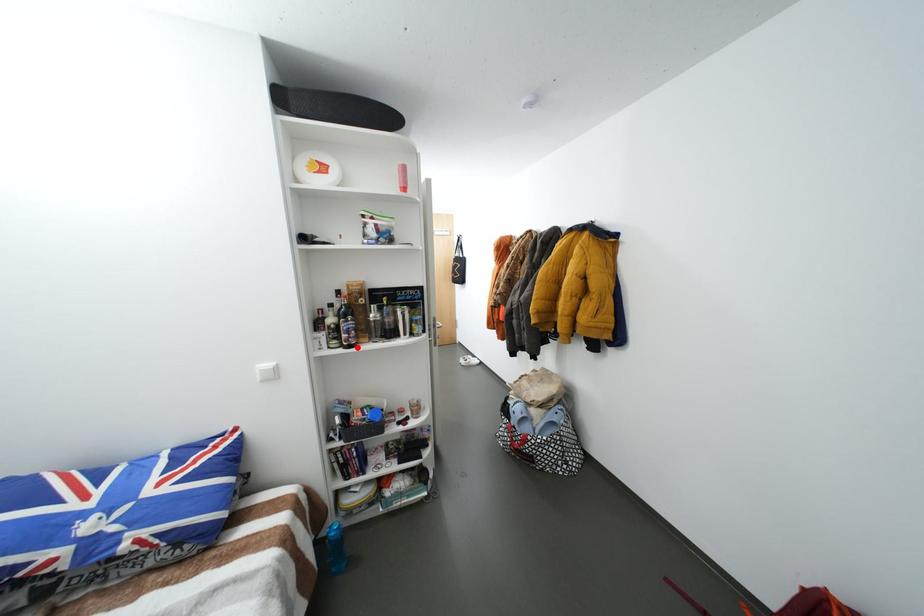
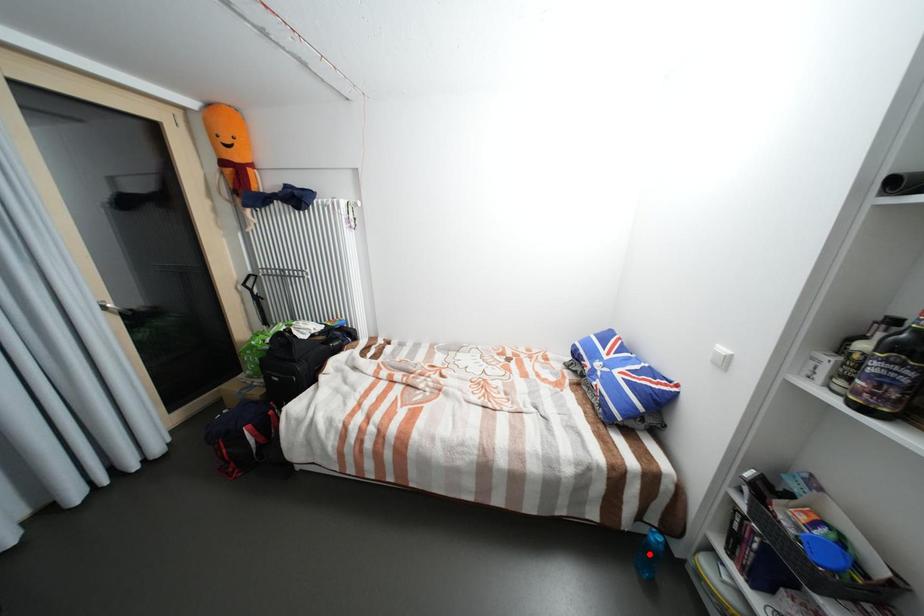
I am providing you with two images of the same scene from different viewpoints. A red point is marked on the first image and another point is marked on the second image. Is the red point in image1 aligned with the point shown in image2?

No